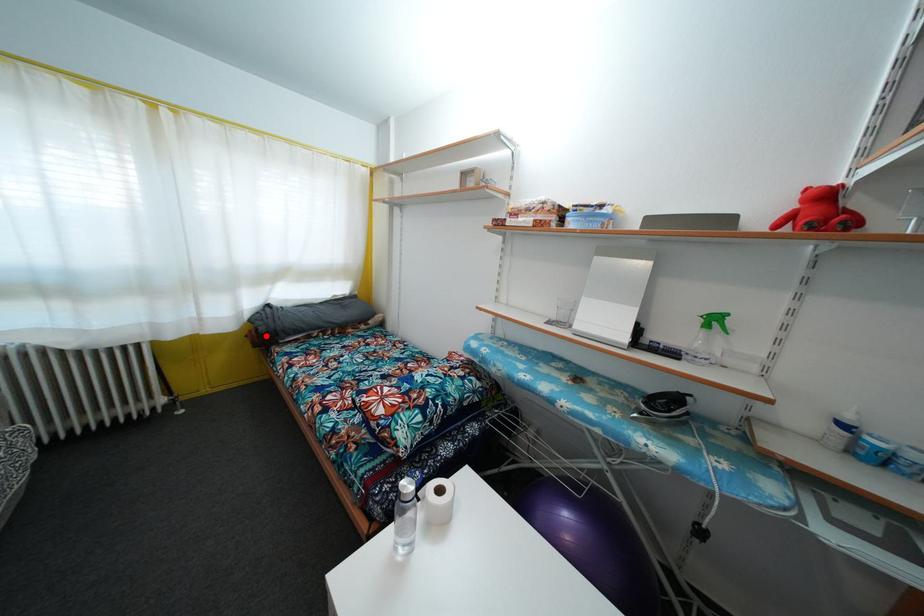
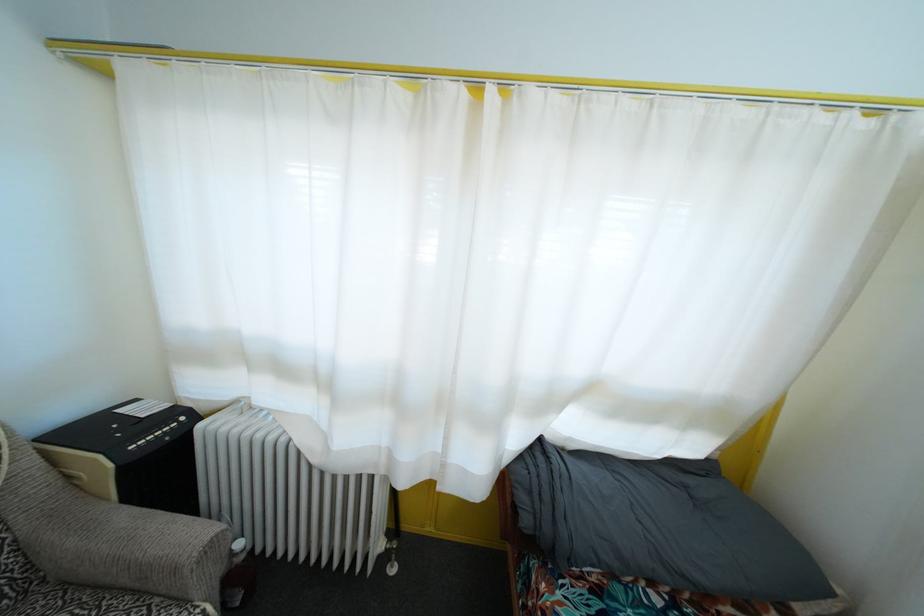
The point at the highlighted location is marked in the first image. Where is the corresponding point in the second image?

(529, 528)